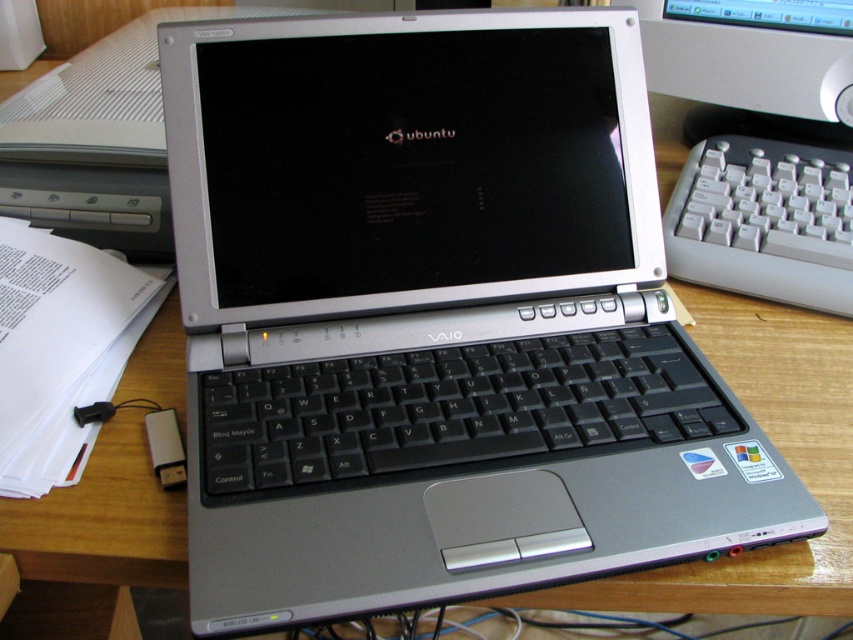
Question: Is gray plastic keyboard at right behind matte black monitor at upper center?

Choices:
 (A) yes
 (B) no

Answer: (B)

Question: Is gray plastic keyboard at right thinner than matte black monitor at upper center?

Choices:
 (A) no
 (B) yes

Answer: (B)

Question: Can you confirm if gray plastic keyboard at right is wider than matte black monitor at upper center?

Choices:
 (A) no
 (B) yes

Answer: (A)

Question: Which point is farther to the camera?

Choices:
 (A) (717, 276)
 (B) (776, 106)

Answer: (B)

Question: Which point is farther from the camera taking this photo?

Choices:
 (A) (750, 241)
 (B) (787, 45)

Answer: (B)

Question: Which point appears farthest from the camera in this image?

Choices:
 (A) (846, 131)
 (B) (770, 250)

Answer: (A)